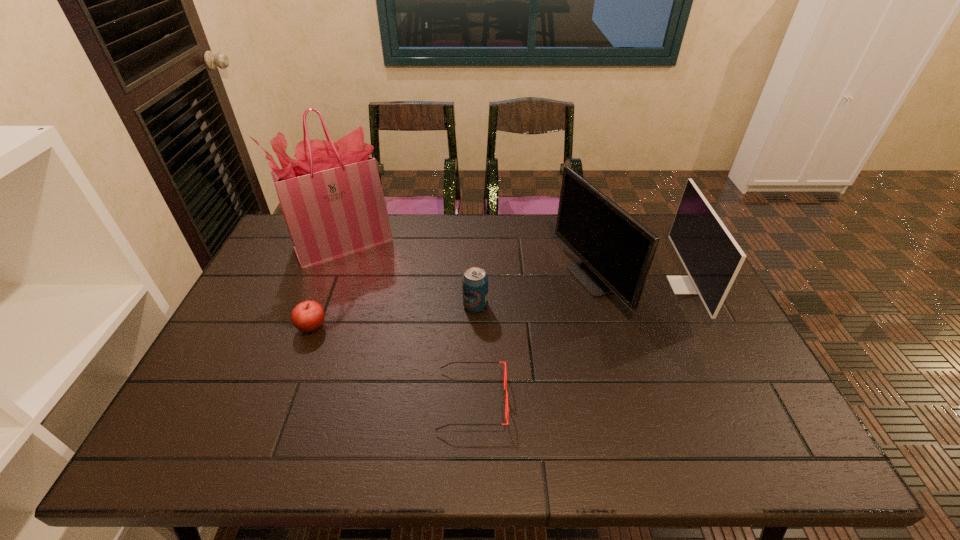
At what (x,y) coordinates should I click in order to perform the action: click on the tallest object. Please return your answer as a coordinate pair (x, y). This screenshot has width=960, height=540. Looking at the image, I should click on (331, 197).

Find the location of a particular element. The width and height of the screenshot is (960, 540). the second object from right to left is located at coordinates (616, 250).

This screenshot has height=540, width=960. I want to click on the right monitor, so click(712, 258).

Locate an element on the screen. the fourth tallest object is located at coordinates (475, 279).

Identify the location of apple. (307, 316).

Identify the location of the nearest object. (505, 374).

Locate an element on the screen. spectacles is located at coordinates (505, 374).

The width and height of the screenshot is (960, 540). What are the coordinates of `free spot located on the right of the tallest object` in the screenshot? It's located at (500, 243).

Identify the location of free location located 0.200m on the front-facing side of the fifth object from left to right. (496, 279).

This screenshot has height=540, width=960. In order to click on blank area located 0.150m on the front-facing side of the fifth object from left to right in this screenshot , I will do `click(512, 279)`.